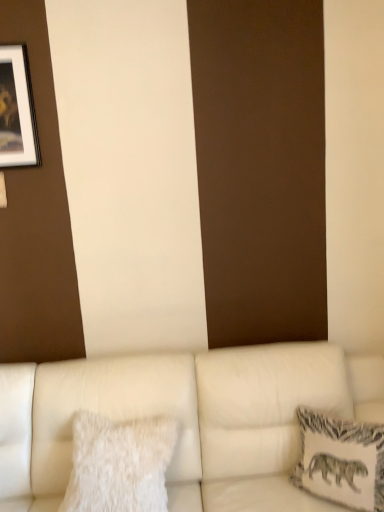
Question: Is white leather couch at lower center taller than white fluffy pillow at lower left, the 1th pillow positioned from the left?

Choices:
 (A) yes
 (B) no

Answer: (A)

Question: Is white leather couch at lower center outside white fluffy pillow at lower left, acting as the second pillow starting from the right?

Choices:
 (A) yes
 (B) no

Answer: (A)

Question: From a real-world perspective, is white leather couch at lower center on white fluffy pillow at lower left, acting as the second pillow starting from the right?

Choices:
 (A) yes
 (B) no

Answer: (B)

Question: Is white fluffy pillow at lower left, acting as the second pillow starting from the right, inside white leather couch at lower center?

Choices:
 (A) yes
 (B) no

Answer: (A)

Question: Considering the relative sizes of white leather couch at lower center and white fluffy pillow at lower left, acting as the second pillow starting from the right, in the image provided, is white leather couch at lower center wider than white fluffy pillow at lower left, acting as the second pillow starting from the right,?

Choices:
 (A) yes
 (B) no

Answer: (A)

Question: Is white leather couch at lower center thinner than white fluffy pillow at lower left, the 1th pillow positioned from the left?

Choices:
 (A) yes
 (B) no

Answer: (B)

Question: Does white textured pillow at right, arranged as the second pillow when viewed from the left, appear on the left side of white leather couch at lower center?

Choices:
 (A) no
 (B) yes

Answer: (A)

Question: Is white textured pillow at right, acting as the first pillow starting from the right, far from white leather couch at lower center?

Choices:
 (A) yes
 (B) no

Answer: (B)

Question: Is white textured pillow at right, acting as the first pillow starting from the right, with white leather couch at lower center?

Choices:
 (A) no
 (B) yes

Answer: (A)

Question: Can you confirm if white textured pillow at right, arranged as the second pillow when viewed from the left, is positioned to the right of white leather couch at lower center?

Choices:
 (A) yes
 (B) no

Answer: (A)

Question: Can you confirm if white textured pillow at right, acting as the first pillow starting from the right, is smaller than white leather couch at lower center?

Choices:
 (A) no
 (B) yes

Answer: (B)

Question: From the image's perspective, is white textured pillow at right, arranged as the second pillow when viewed from the left, located above white leather couch at lower center?

Choices:
 (A) yes
 (B) no

Answer: (A)

Question: Is white fluffy pillow at lower left, acting as the second pillow starting from the right, to the left of matte black picture frame at upper left from the viewer's perspective?

Choices:
 (A) no
 (B) yes

Answer: (A)